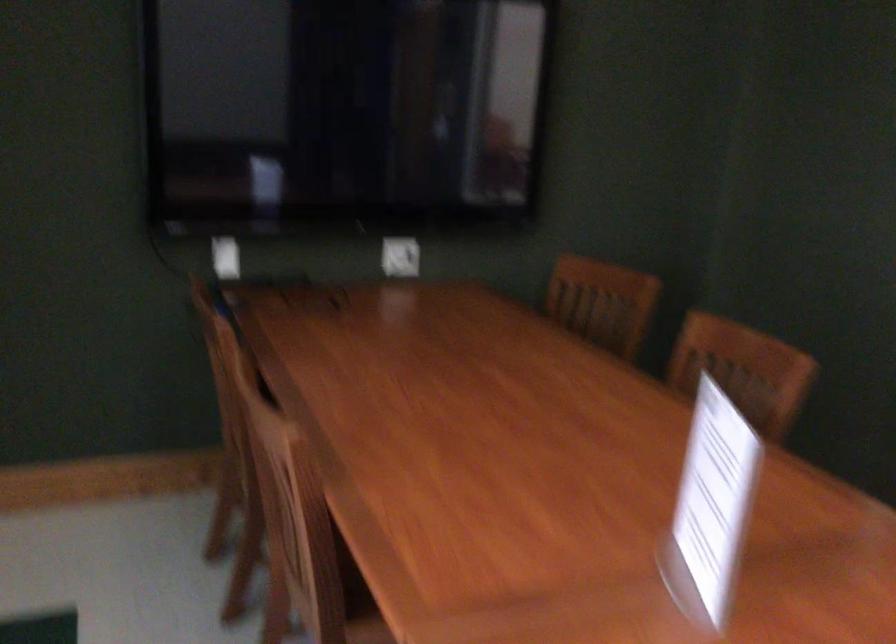
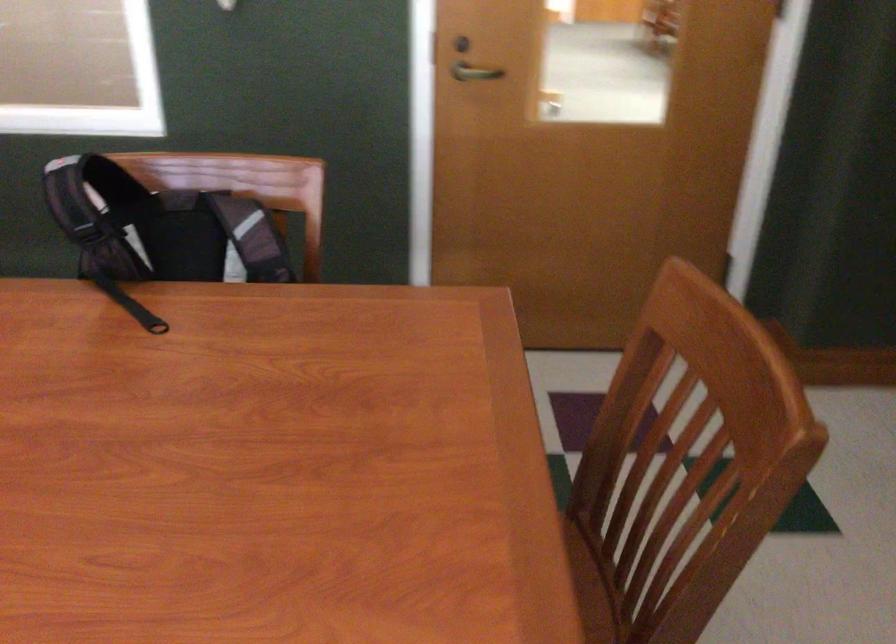
First-person continuous shooting, in which direction is the camera rotating?

The camera's rotation is toward right-down.